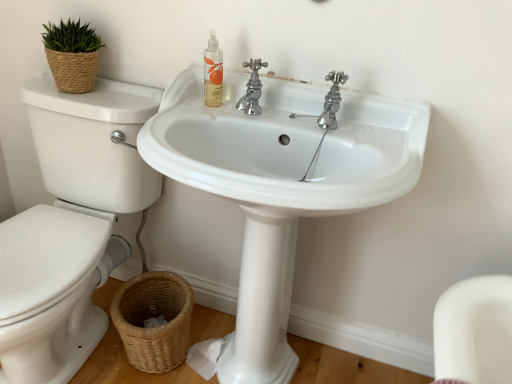
Question: Considering the relative positions of translucent plastic bottle at upper center and chrome metallic faucet at upper center in the image provided, is translucent plastic bottle at upper center to the left of chrome metallic faucet at upper center from the viewer's perspective?

Choices:
 (A) yes
 (B) no

Answer: (A)

Question: Does translucent plastic bottle at upper center have a greater width compared to chrome metallic faucet at upper center?

Choices:
 (A) yes
 (B) no

Answer: (B)

Question: Is translucent plastic bottle at upper center behind chrome metallic faucet at upper center?

Choices:
 (A) no
 (B) yes

Answer: (B)

Question: From a real-world perspective, is translucent plastic bottle at upper center under chrome metallic faucet at upper center?

Choices:
 (A) yes
 (B) no

Answer: (B)

Question: Is translucent plastic bottle at upper center to the right of chrome metallic faucet at upper center from the viewer's perspective?

Choices:
 (A) yes
 (B) no

Answer: (B)

Question: From a real-world perspective, is translucent plastic bottle at upper center located higher than chrome metallic faucet at upper center?

Choices:
 (A) yes
 (B) no

Answer: (A)

Question: Is translucent plastic bottle at upper center completely or partially outside of white glossy sink at center?

Choices:
 (A) no
 (B) yes

Answer: (A)

Question: From a real-world perspective, is translucent plastic bottle at upper center under white glossy sink at center?

Choices:
 (A) no
 (B) yes

Answer: (A)

Question: Can you confirm if translucent plastic bottle at upper center is smaller than white glossy sink at center?

Choices:
 (A) no
 (B) yes

Answer: (B)

Question: Is translucent plastic bottle at upper center far away from white glossy sink at center?

Choices:
 (A) yes
 (B) no

Answer: (B)

Question: Is translucent plastic bottle at upper center directly adjacent to white glossy sink at center?

Choices:
 (A) no
 (B) yes

Answer: (A)

Question: Can you confirm if translucent plastic bottle at upper center is positioned to the right of white glossy sink at center?

Choices:
 (A) no
 (B) yes

Answer: (A)

Question: Is woven brown basket at lower left not near chrome metallic faucet at upper center?

Choices:
 (A) yes
 (B) no

Answer: (B)